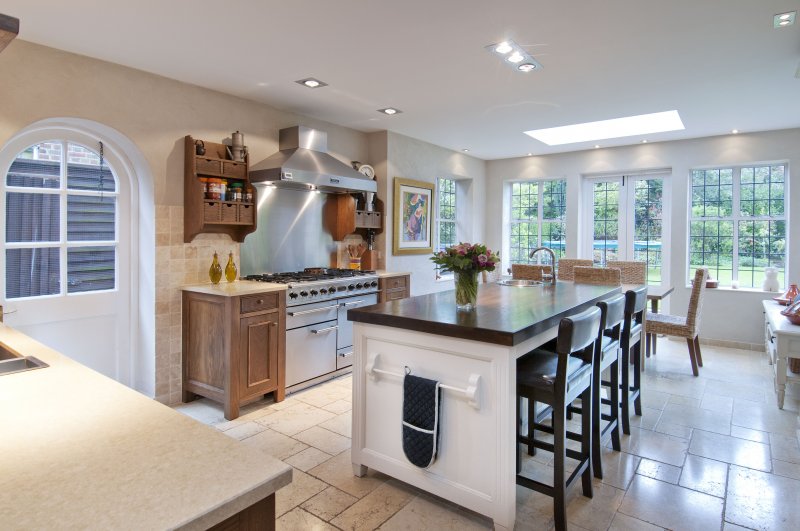
I want to click on can light, so click(x=530, y=64).